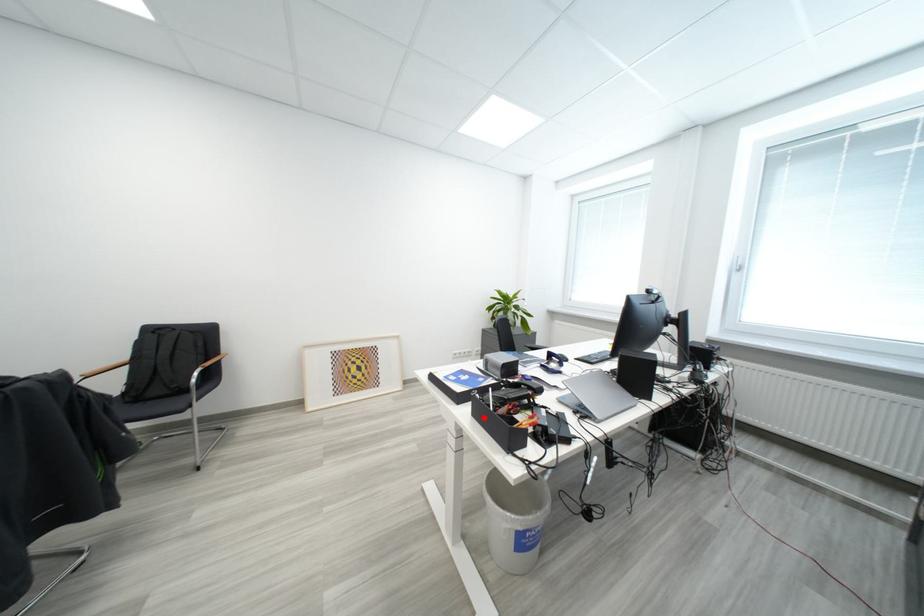
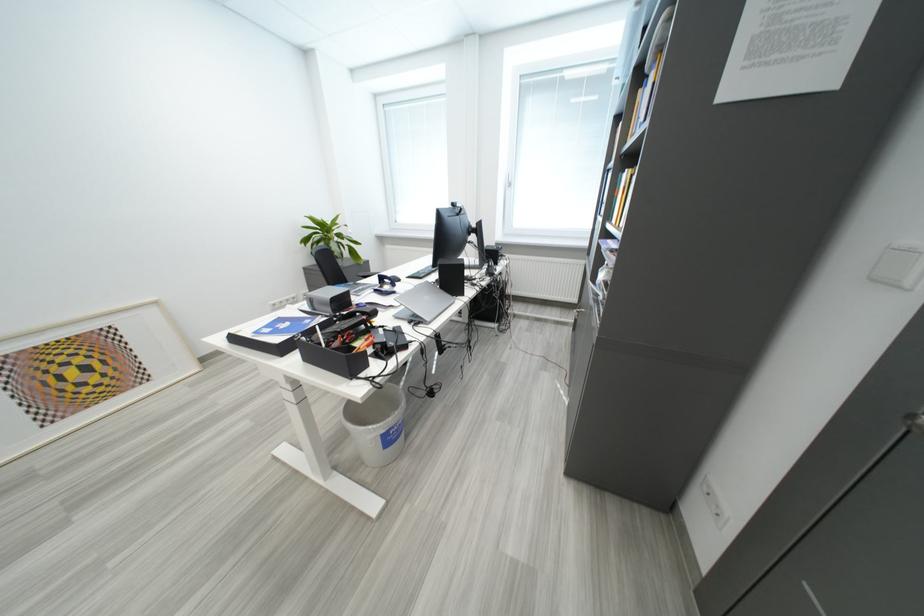
Find the pixel in the second image that matches the highlighted location in the first image.

(315, 362)